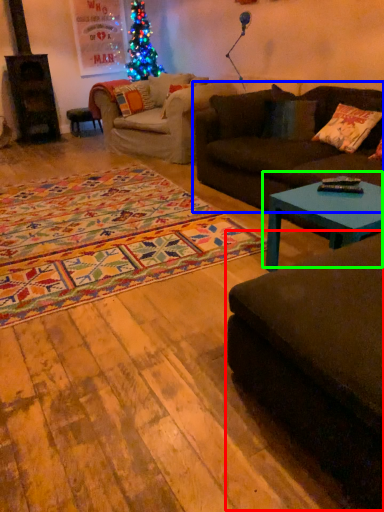
Question: Estimate the real-world distances between objects in this image. Which object is closer to studio couch (highlighted by a red box), studio couch (highlighted by a blue box) or coffee table (highlighted by a green box)?

Choices:
 (A) studio couch
 (B) coffee table

Answer: (B)